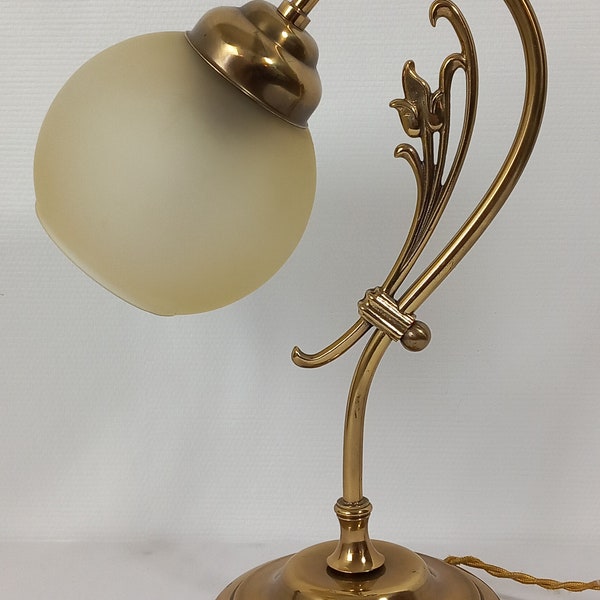
Find the location of a particular element. The height and width of the screenshot is (600, 600). decoration on lamp arm is located at coordinates (415, 105).